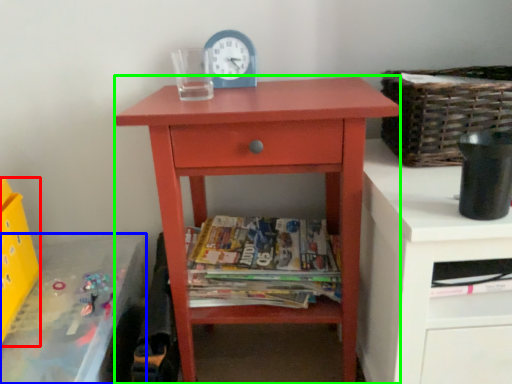
Question: Which object is the farthest from crate (highlighted by a red box)? Choose among these: changing table (highlighted by a blue box) or nightstand (highlighted by a green box).

Choices:
 (A) changing table
 (B) nightstand

Answer: (B)